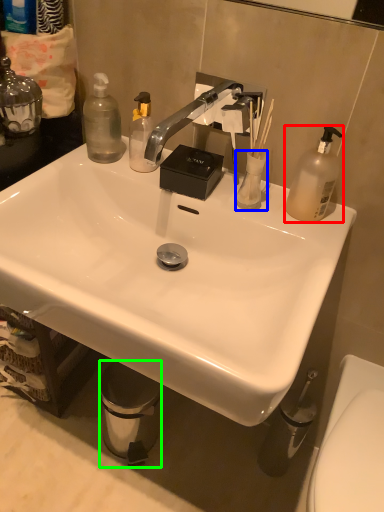
Question: Which object is positioned closest to bottle (highlighted by a red box)? Select from toiletries (highlighted by a blue box) and trash bin/can (highlighted by a green box).

Choices:
 (A) toiletries
 (B) trash bin/can

Answer: (A)